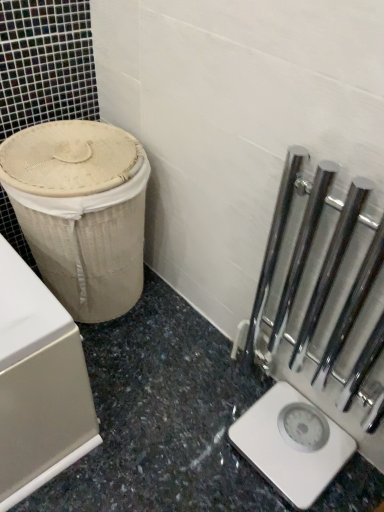
Question: Can you confirm if white plastic scale at lower right is bigger than polished chrome rail at right?

Choices:
 (A) yes
 (B) no

Answer: (B)

Question: Is white plastic scale at lower right beside polished chrome rail at right?

Choices:
 (A) yes
 (B) no

Answer: (B)

Question: Is white plastic scale at lower right oriented away from polished chrome rail at right?

Choices:
 (A) yes
 (B) no

Answer: (B)

Question: Does white plastic scale at lower right lie behind polished chrome rail at right?

Choices:
 (A) no
 (B) yes

Answer: (B)

Question: Is white plastic scale at lower right at the left side of polished chrome rail at right?

Choices:
 (A) no
 (B) yes

Answer: (B)

Question: From the image's perspective, is beige woven basket at left above or below white plastic scale at lower right?

Choices:
 (A) above
 (B) below

Answer: (A)

Question: Is beige woven basket at left bigger or smaller than white plastic scale at lower right?

Choices:
 (A) big
 (B) small

Answer: (A)

Question: Considering their positions, is beige woven basket at left located in front of or behind white plastic scale at lower right?

Choices:
 (A) front
 (B) behind

Answer: (A)

Question: Which is correct: beige woven basket at left is inside white plastic scale at lower right, or outside of it?

Choices:
 (A) outside
 (B) inside

Answer: (A)

Question: From the image's perspective, is white plastic scale at lower right located above or below polished chrome rail at right?

Choices:
 (A) above
 (B) below

Answer: (B)

Question: In terms of size, does white plastic scale at lower right appear bigger or smaller than polished chrome rail at right?

Choices:
 (A) small
 (B) big

Answer: (A)

Question: From a real-world perspective, is white plastic scale at lower right positioned above or below polished chrome rail at right?

Choices:
 (A) below
 (B) above

Answer: (A)

Question: Considering the positions of point [x=264, y=400] and point [x=269, y=271], is point [x=264, y=400] closer or farther from the camera than point [x=269, y=271]?

Choices:
 (A) closer
 (B) farther

Answer: (B)

Question: Considering the positions of point (44, 211) and point (344, 394), is point (44, 211) closer or farther from the camera than point (344, 394)?

Choices:
 (A) closer
 (B) farther

Answer: (A)

Question: In the image, is beige woven basket at left on the left side or the right side of polished chrome rail at right?

Choices:
 (A) right
 (B) left

Answer: (B)